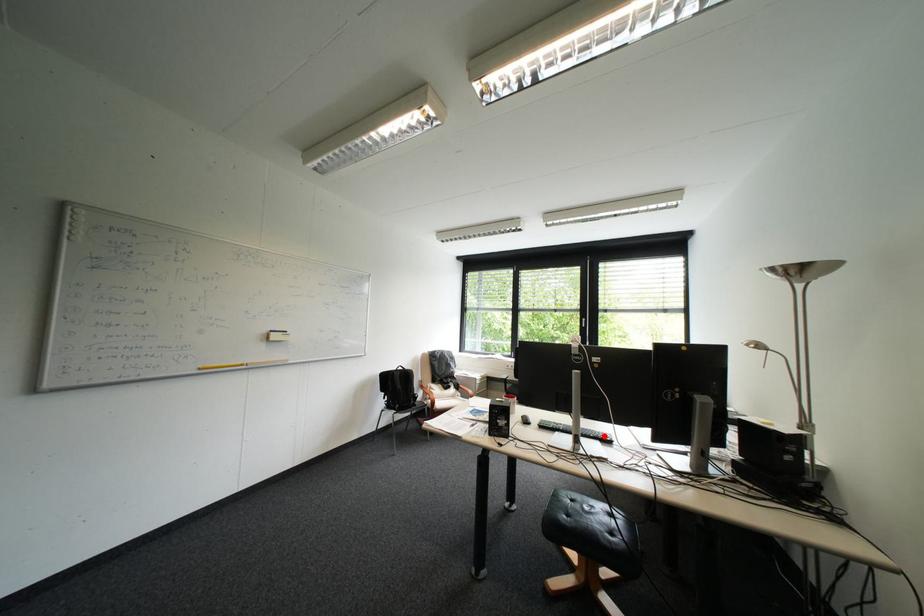
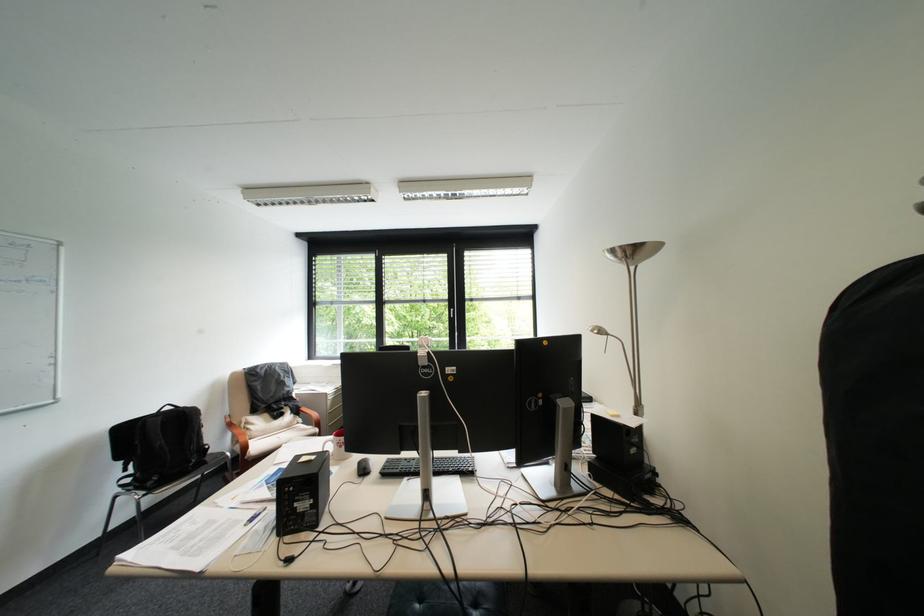
In the second image, find the point that corresponds to the highlighted location in the first image.

(463, 469)